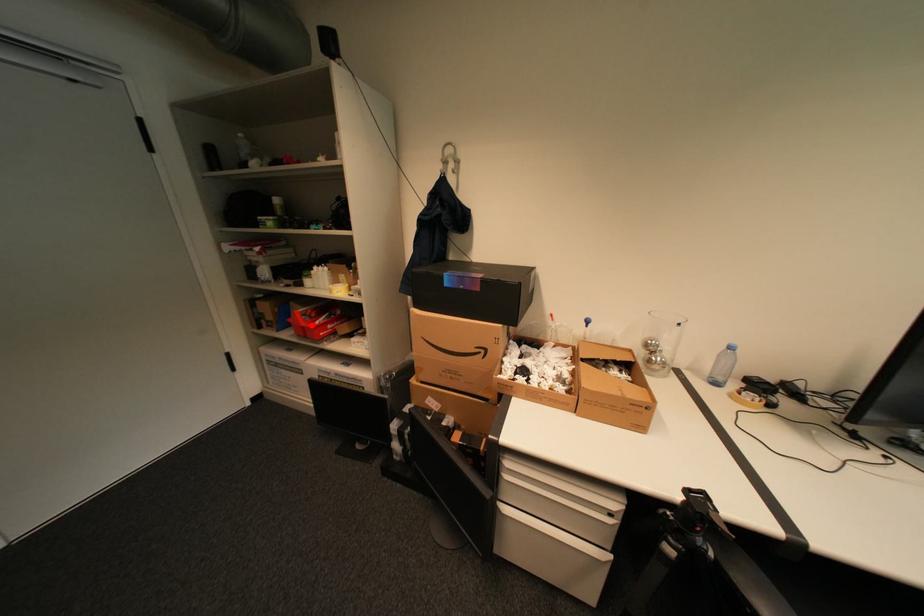
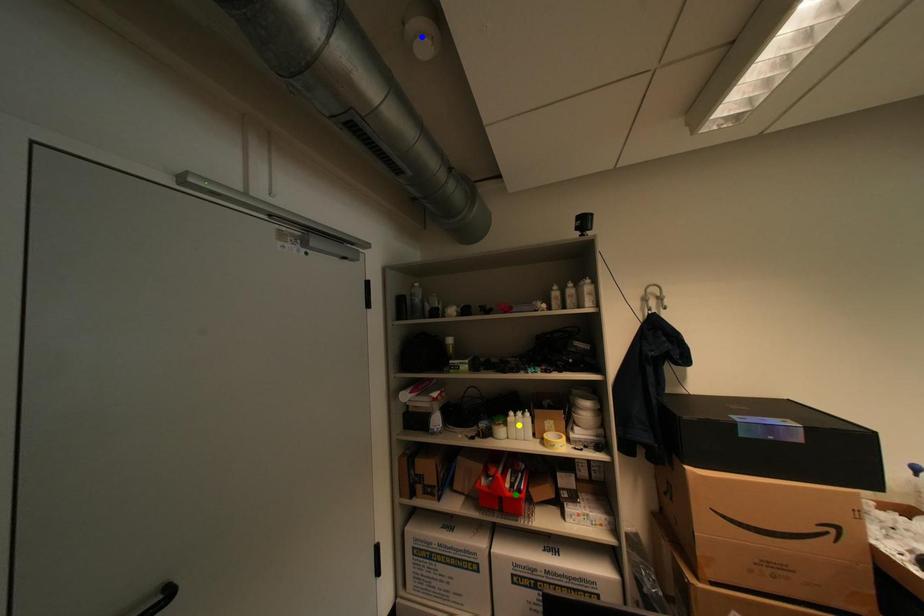
Question: I am providing you with two images of the same scene from different viewpoints. A red point is marked on the first image. You are given multiple points on the second image. Which point in image 2 represents the same 3d spot as the red point in image 1?

Choices:
 (A) yellow point
 (B) green point
 (C) blue point

Answer: (B)